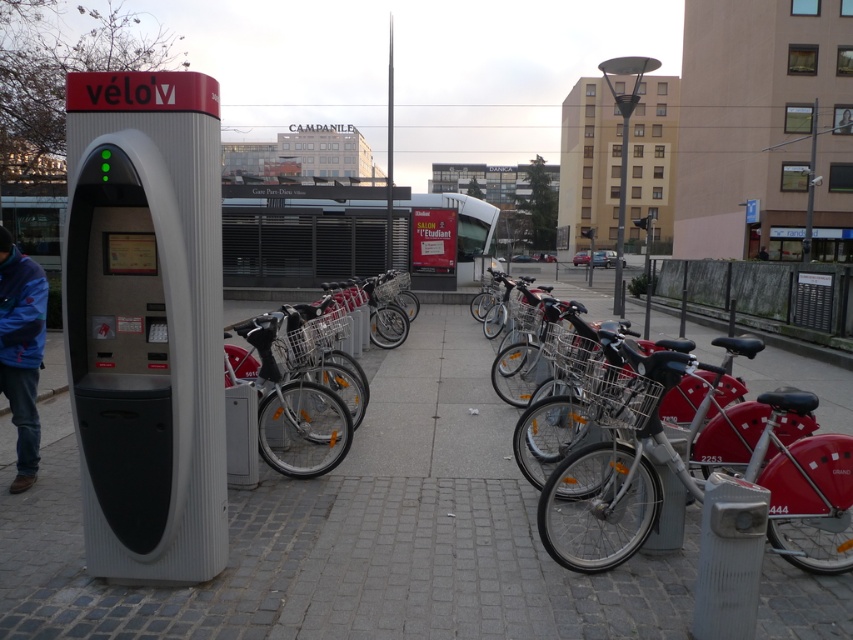
Question: Does gray cobblestone pavement at center come behind blue fleece jacket at lower left?

Choices:
 (A) no
 (B) yes

Answer: (A)

Question: Which is farther from the metallic silver bicycle at center?

Choices:
 (A) matte red bicycle at center
 (B) gray cobblestone pavement at center
 (C) blue fleece jacket at lower left

Answer: (C)

Question: Which point is closer to the camera?

Choices:
 (A) (30, 458)
 (B) (785, 540)
 (C) (53, 568)
 (D) (260, 388)

Answer: (C)

Question: Does matte red bicycle at center appear on the right side of blue fleece jacket at lower left?

Choices:
 (A) yes
 (B) no

Answer: (A)

Question: Can you confirm if gray cobblestone pavement at center is positioned to the right of blue fleece jacket at lower left?

Choices:
 (A) no
 (B) yes

Answer: (B)

Question: Which object appears farthest from the camera in this image?

Choices:
 (A) blue fleece jacket at lower left
 (B) matte red bicycle at center

Answer: (B)